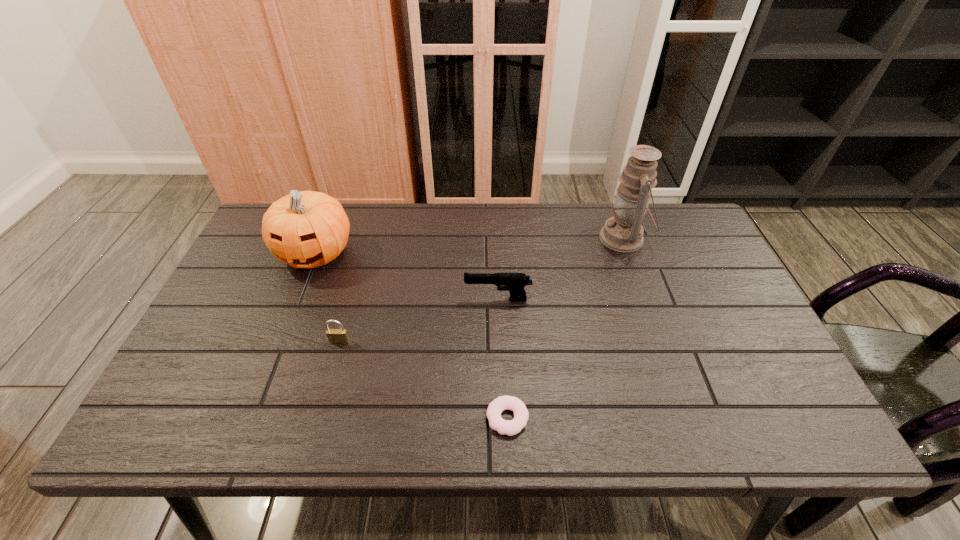
Identify the location of the rightmost object. (623, 232).

Locate an element on the screen. The image size is (960, 540). oil lamp is located at coordinates (623, 232).

This screenshot has height=540, width=960. I want to click on pumpkin, so click(306, 229).

Identify the location of the fourth shortest object. This screenshot has height=540, width=960. (306, 229).

Locate an element on the screen. pistol is located at coordinates (515, 282).

This screenshot has height=540, width=960. I want to click on the third shortest object, so click(515, 282).

Where is `the second shortest object`? The image size is (960, 540). the second shortest object is located at coordinates (335, 336).

Where is `padlock`? The width and height of the screenshot is (960, 540). padlock is located at coordinates (335, 336).

Find the location of a particular element. Image resolution: width=960 pixels, height=540 pixels. doughnut is located at coordinates (497, 406).

The width and height of the screenshot is (960, 540). What are the coordinates of `the nearest object` in the screenshot? It's located at (497, 406).